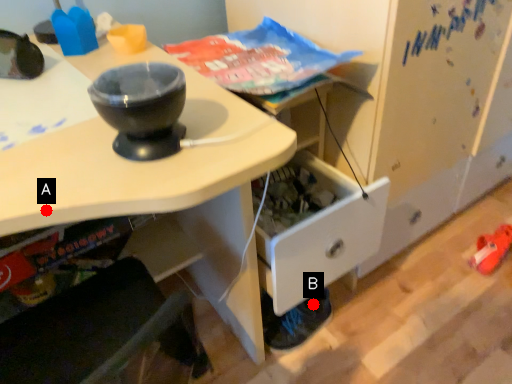
Question: Two points are circled on the image, labeled by A and B beside each circle. Which point is further to the camera?

Choices:
 (A) A is further
 (B) B is further

Answer: (B)